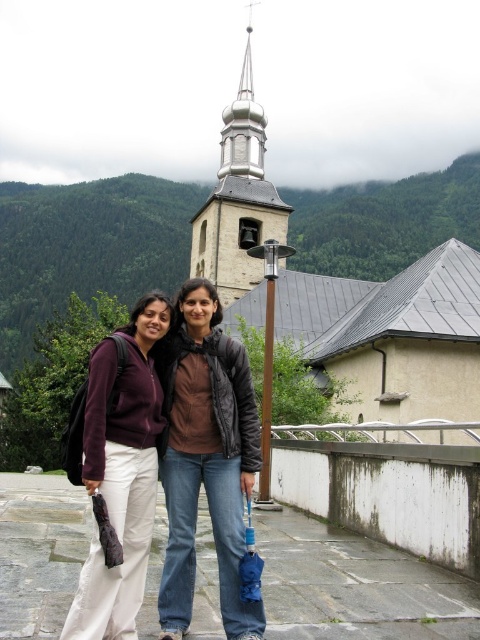
You are planning to take a photo of the gold polished spire at upper center and the brown matte jacket at center. Considering their sizes in the image, which object will appear larger in the photo?

The gold polished spire at upper center is much taller than the brown matte jacket at center, so it will appear larger in the photo.

You are a photographer trying to capture both the matte black jacket at center and the gold polished spire at upper center in a single shot. Considering their sizes, which object should you focus on first to ensure both are clearly visible in the frame?

The matte black jacket at center has a smaller size compared to the gold polished spire at upper center, so you should focus on the matte black jacket at center first to ensure its details are sharp while the larger spire will remain in focus more easily.